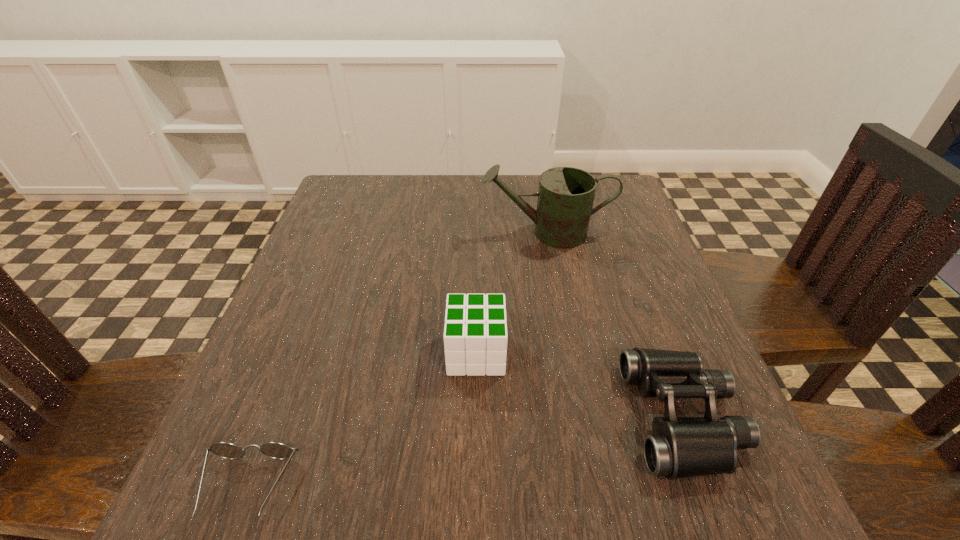
Find the location of a particular element. object that is at the far right corner is located at coordinates (566, 195).

Identify the location of object situated at the near right corner. The image size is (960, 540). (680, 447).

You are a GUI agent. You are given a task and a screenshot of the screen. Output one action in this format:
    pyautogui.click(x=<x>, y=<y>)
    Task: Click on the vacant space at the far edge
    Image resolution: width=960 pixels, height=540 pixels.
    Given the screenshot: What is the action you would take?
    pyautogui.click(x=465, y=204)

The height and width of the screenshot is (540, 960). I want to click on vacant space at the near edge, so click(591, 497).

The height and width of the screenshot is (540, 960). Find the location of `free space at the left edge of the desktop`. free space at the left edge of the desktop is located at coordinates (236, 440).

In the image, there is a desktop. Where is `vacant space at the right edge`? Image resolution: width=960 pixels, height=540 pixels. vacant space at the right edge is located at coordinates (606, 237).

This screenshot has width=960, height=540. In the image, there is a desktop. In order to click on free space at the far left corner in this screenshot , I will do `click(333, 210)`.

In the image, there is a desktop. Identify the location of vacant space at the near left corner. The height and width of the screenshot is (540, 960). (263, 470).

Find the location of a particular element. The height and width of the screenshot is (540, 960). vacant space at the far right corner is located at coordinates coord(605,207).

The image size is (960, 540). I want to click on vacant point located between the third tallest object and the second tallest object, so click(579, 385).